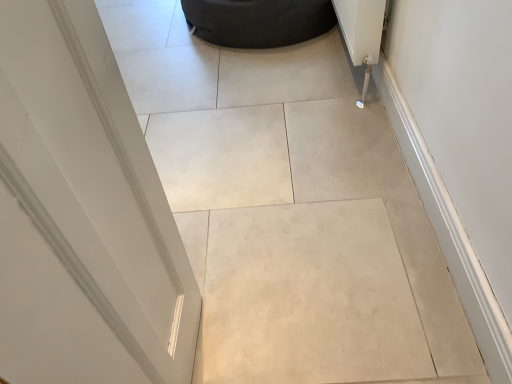
At what (x,y) coordinates should I click in order to perform the action: click on vacant space to the left of dark gray fabric bean bag at upper center. Please return your answer as a coordinate pair (x, y). The height and width of the screenshot is (384, 512). Looking at the image, I should click on (151, 36).